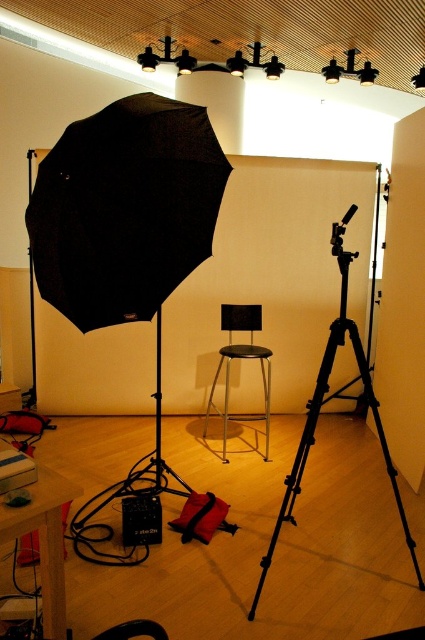
What is the location of the point with coordinates (124, 209) in the photography studio setup?

The point with coordinates (124, 209) is located on the black matte umbrella at upper left.

You are setting up a photography studio and need to adjust the height of the black matte umbrella at upper left and the black metal tripod at center so that both are at the same level. Which object should you raise or lower, and by how much?

The black matte umbrella at upper left has a lesser height compared to the black metal tripod at center. To make them the same level, you should raise the black matte umbrella at upper left by the difference in their heights.

You are setting up a photography studio and need to place a large camera on the black metal tripod at center. The metallic stool at center is currently occupying space near the tripod. Based on their sizes, can the camera be mounted on the tripod without moving the stool?

The black metal tripod at center has a larger size compared to the metallic stool at center. Since the tripod is bigger, there should be enough space to mount the camera on the tripod without needing to move the stool.